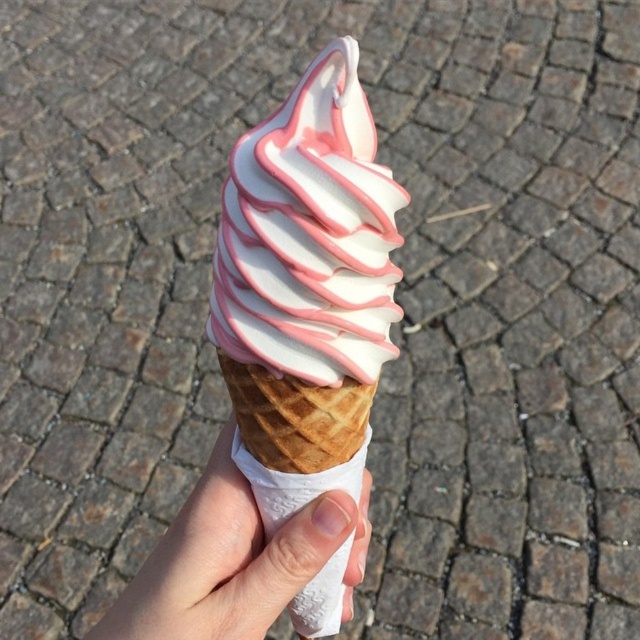
You are holding a smartphone that is 6.2 inches wide. You want to take a photo of the pink matte ice cream cone at center. If you position your phone 18.83 inches away from the cone, will the entire cone fit in the frame?

The pink matte ice cream cone at center and viewer are 18.83 inches apart. Since the phone is positioned at that distance, and the phone is 6.2 inches wide, the entire cone will fit in the frame as the distance allows the phone to capture the cone within its width.

You are standing on the cobblestone pavement in the background of the image. You want to walk towards the hand holding the soft serve ice cream cone. Which point, point [308,490] or point [112,621], is closer to you as you start walking?

Point [308,490] is closer to you because it is further to the viewer than point [112,621].

You are holding a pink matte ice cream cone at center and a white paper at center. Which object is closer to your hand?

The pink matte ice cream cone at center is closer to your hand because it is in front of the white paper at center.